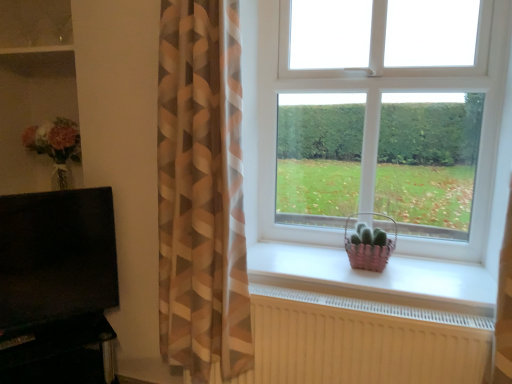
I want to click on vacant space in black matte tv at left, which is the 1th entertainment center from top to bottom (from a real-world perspective), so tap(53, 325).